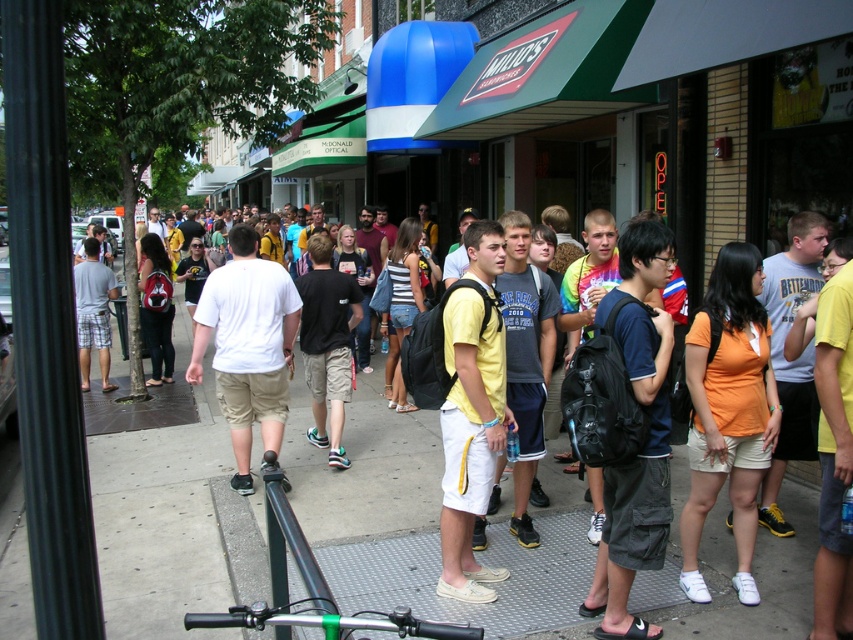
Who is shorter, yellow t-shirt at center or light gray plaid shorts at center?

yellow t-shirt at center is shorter.

From the picture: Is yellow t-shirt at center below light gray plaid shorts at center?

Yes, yellow t-shirt at center is below light gray plaid shorts at center.

Locate an element on the screen. yellow t-shirt at center is located at coordinates (404, 509).

The height and width of the screenshot is (640, 853). I want to click on yellow t-shirt at center, so click(x=404, y=509).

The height and width of the screenshot is (640, 853). What do you see at coordinates (469, 440) in the screenshot?
I see `yellow cotton shirt at center` at bounding box center [469, 440].

Between yellow cotton shirt at center and white cotton t-shirt at center, which one has less height?

white cotton t-shirt at center is shorter.

At what (x,y) coordinates should I click in order to perform the action: click on yellow cotton shirt at center. Please return your answer as a coordinate pair (x, y). Image resolution: width=853 pixels, height=640 pixels. Looking at the image, I should click on (469, 440).

The width and height of the screenshot is (853, 640). Find the location of `yellow cotton shirt at center`. yellow cotton shirt at center is located at coordinates (469, 440).

In the scene shown: Does yellow t-shirt at center appear on the right side of white cotton t-shirt at center?

In fact, yellow t-shirt at center is to the left of white cotton t-shirt at center.

Is yellow t-shirt at center closer to the viewer compared to white cotton t-shirt at center?

Yes.

Does point (393, 604) come in front of point (242, 326)?

Yes, it is.

Locate an element on the screen. The height and width of the screenshot is (640, 853). yellow t-shirt at center is located at coordinates (404, 509).